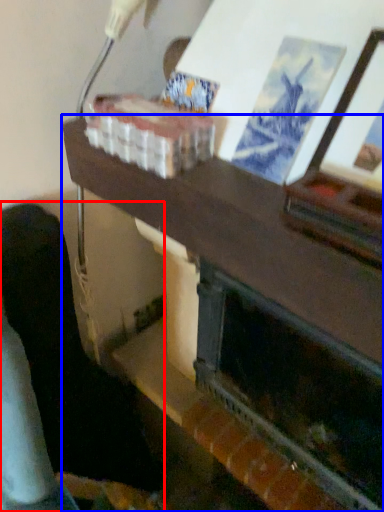
Question: Which of the following is the closest to the observer, furniture (highlighted by a red box) or table (highlighted by a blue box)?

Choices:
 (A) furniture
 (B) table

Answer: (B)